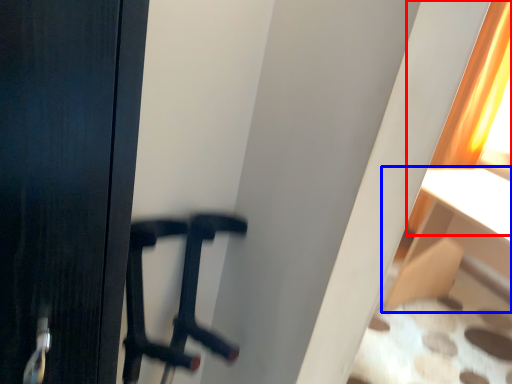
Question: Which of the following is the closest to the observer, curtain (highlighted by a red box) or furniture (highlighted by a blue box)?

Choices:
 (A) curtain
 (B) furniture

Answer: (B)